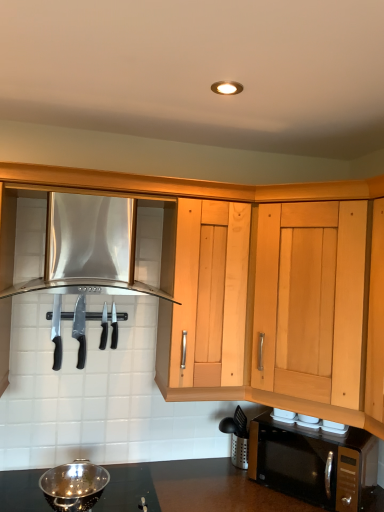
Image resolution: width=384 pixels, height=512 pixels. Find the location of `polished stainless steel bowl at lower left`. polished stainless steel bowl at lower left is located at coordinates (74, 486).

The image size is (384, 512). What do you see at coordinates (80, 329) in the screenshot?
I see `polished silver knife at center, the first knife positioned from the right` at bounding box center [80, 329].

The image size is (384, 512). What are the coordinates of `polished silver knife at center, the first knife positioned from the right` in the screenshot? It's located at (80, 329).

Locate an element on the screen. Image resolution: width=384 pixels, height=512 pixels. stainless steel range hood at upper left, marked as the first cabinetry in a left-to-right arrangement is located at coordinates (89, 248).

Image resolution: width=384 pixels, height=512 pixels. What do you see at coordinates (311, 300) in the screenshot?
I see `light wood cabinet at upper right, the first cabinetry from the right` at bounding box center [311, 300].

This screenshot has height=512, width=384. I want to click on polished stainless steel knife at center, the 2th silverware positioned from the left, so click(114, 327).

At what (x,y) coordinates should I click in order to perform the action: click on polished stainless steel bowl at lower left. Please return your answer as a coordinate pair (x, y). This screenshot has height=512, width=384. Looking at the image, I should click on (74, 486).

Is black plastic knife at left, which appears as the first knife when viewed from the left, surrounding black matte microwave at lower right?

No.

Which object is thinner, black plastic knife at left, which appears as the first knife when viewed from the left, or black matte microwave at lower right?

black plastic knife at left, which appears as the first knife when viewed from the left.

From the image's perspective, is black plastic knife at left, which appears as the first knife when viewed from the left, under black matte microwave at lower right?

No.

Can you tell me how much black plastic knife at left, which appears as the second knife when viewed from the right, and black matte microwave at lower right differ in facing direction?

black plastic knife at left, which appears as the second knife when viewed from the right, and black matte microwave at lower right are facing 47.1 degrees away from each other.

I want to click on appliance beneath the light wood cabinet at upper right, which ranks as the 2th cabinetry in left-to-right order (from a real-world perspective), so click(x=74, y=486).

Does light wood cabinet at upper right, the first cabinetry from the right, have a greater height compared to polished stainless steel bowl at lower left?

Correct, light wood cabinet at upper right, the first cabinetry from the right, is much taller as polished stainless steel bowl at lower left.

Is light wood cabinet at upper right, the first cabinetry from the right, next to polished stainless steel bowl at lower left and touching it?

No, light wood cabinet at upper right, the first cabinetry from the right, is not beside polished stainless steel bowl at lower left.

Considering the sizes of objects polished silver knife at center, the second knife viewed from the left, and stainless steel range hood at upper left, marked as the first cabinetry in a left-to-right arrangement, in the image provided, who is thinner, polished silver knife at center, the second knife viewed from the left, or stainless steel range hood at upper left, marked as the first cabinetry in a left-to-right arrangement,?

polished silver knife at center, the second knife viewed from the left.

Is point (78, 361) closer to camera compared to point (51, 195)?

No, it is behind (51, 195).

Which knife is the 2nd one when counting from the back of the stainless steel range hood at upper left, the 2th cabinetry from the right? Please provide its 2D coordinates.

[(80, 329)]

From a real-world perspective, between polished silver knife at center, the first knife positioned from the right, and stainless steel range hood at upper left, marked as the first cabinetry in a left-to-right arrangement, who is vertically higher?

stainless steel range hood at upper left, marked as the first cabinetry in a left-to-right arrangement, is physically above.

Based on the photo, is stainless steel range hood at upper left, the 2th cabinetry from the right, closer to the viewer compared to black plastic knife at center, the first silverware viewed from the left?

Yes, it is.

Measure the distance between stainless steel range hood at upper left, marked as the first cabinetry in a left-to-right arrangement, and black plastic knife at center, arranged as the second silverware when viewed from the right.

stainless steel range hood at upper left, marked as the first cabinetry in a left-to-right arrangement, is 14.92 inches away from black plastic knife at center, arranged as the second silverware when viewed from the right.

Based on the photo, how many degrees apart are the facing directions of stainless steel range hood at upper left, the 2th cabinetry from the right, and black plastic knife at center, the first silverware viewed from the left?

The angular difference between stainless steel range hood at upper left, the 2th cabinetry from the right, and black plastic knife at center, the first silverware viewed from the left, is 0.163 degrees.

Considering the sizes of objects stainless steel range hood at upper left, the 2th cabinetry from the right, and black plastic knife at center, the first silverware viewed from the left, in the image provided, who is wider, stainless steel range hood at upper left, the 2th cabinetry from the right, or black plastic knife at center, the first silverware viewed from the left,?

With larger width is stainless steel range hood at upper left, the 2th cabinetry from the right.

Who is smaller, stainless steel range hood at upper left, the 2th cabinetry from the right, or polished stainless steel knife at center, the 2th silverware positioned from the left?

With smaller size is polished stainless steel knife at center, the 2th silverware positioned from the left.

Consider the image. Which is correct: stainless steel range hood at upper left, the 2th cabinetry from the right, is inside polished stainless steel knife at center, the 2th silverware positioned from the left, or outside of it?

stainless steel range hood at upper left, the 2th cabinetry from the right, exists outside the volume of polished stainless steel knife at center, the 2th silverware positioned from the left.

Identify the location of the 2nd silverware behind the stainless steel range hood at upper left, marked as the first cabinetry in a left-to-right arrangement. This screenshot has height=512, width=384. (114, 327).

Considering the sizes of light wood cabinet at upper right, the first cabinetry from the right, and stainless steel range hood at upper left, the 2th cabinetry from the right, in the image, is light wood cabinet at upper right, the first cabinetry from the right, wider or thinner than stainless steel range hood at upper left, the 2th cabinetry from the right,?

Clearly, light wood cabinet at upper right, the first cabinetry from the right, has less width compared to stainless steel range hood at upper left, the 2th cabinetry from the right.

Is light wood cabinet at upper right, which ranks as the 2th cabinetry in left-to-right order, next to stainless steel range hood at upper left, marked as the first cabinetry in a left-to-right arrangement?

No, light wood cabinet at upper right, which ranks as the 2th cabinetry in left-to-right order, is not next to stainless steel range hood at upper left, marked as the first cabinetry in a left-to-right arrangement.

Which is more to the left, light wood cabinet at upper right, which ranks as the 2th cabinetry in left-to-right order, or stainless steel range hood at upper left, the 2th cabinetry from the right?

stainless steel range hood at upper left, the 2th cabinetry from the right, is more to the left.

Which of these two, light wood cabinet at upper right, which ranks as the 2th cabinetry in left-to-right order, or stainless steel range hood at upper left, marked as the first cabinetry in a left-to-right arrangement, is bigger?

Bigger between the two is light wood cabinet at upper right, which ranks as the 2th cabinetry in left-to-right order.

Can you confirm if black plastic knife at center, the first silverware viewed from the left, is wider than polished stainless steel knife at center, the 2th silverware positioned from the left?

Incorrect, the width of black plastic knife at center, the first silverware viewed from the left, does not surpass that of polished stainless steel knife at center, the 2th silverware positioned from the left.

Measure the distance from black plastic knife at center, arranged as the second silverware when viewed from the right, to polished stainless steel knife at center, the 2th silverware positioned from the left.

A distance of 1.46 inches exists between black plastic knife at center, arranged as the second silverware when viewed from the right, and polished stainless steel knife at center, the 2th silverware positioned from the left.

In the scene shown: Is black plastic knife at center, arranged as the second silverware when viewed from the right, taller or shorter than polished stainless steel knife at center, the 2th silverware positioned from the left?

Clearly, black plastic knife at center, arranged as the second silverware when viewed from the right, is shorter compared to polished stainless steel knife at center, the 2th silverware positioned from the left.

Locate an element on the screen. The image size is (384, 512). silverware that appears behind the black plastic knife at center, arranged as the second silverware when viewed from the right is located at coordinates (114, 327).

Find the location of `microwave oven in front of the black plastic knife at left, which appears as the second knife when viewed from the right`. microwave oven in front of the black plastic knife at left, which appears as the second knife when viewed from the right is located at coordinates (312, 462).

Where is `appliance that is under the light wood cabinet at upper right, which ranks as the 2th cabinetry in left-to-right order (from a real-world perspective)`? The height and width of the screenshot is (512, 384). appliance that is under the light wood cabinet at upper right, which ranks as the 2th cabinetry in left-to-right order (from a real-world perspective) is located at coordinates (74, 486).

From the picture: From the image, which object appears to be nearer to polished silver knife at center, the second knife viewed from the left, black matte microwave at lower right or polished stainless steel knife at center, which is counted as the 1th silverware, starting from the right?

Based on the image, polished stainless steel knife at center, which is counted as the 1th silverware, starting from the right, appears to be nearer to polished silver knife at center, the second knife viewed from the left.

When comparing their distances from black matte microwave at lower right, does stainless steel range hood at upper left, the 2th cabinetry from the right, or polished silver knife at center, the first knife positioned from the right, seem further?

Based on the image, polished silver knife at center, the first knife positioned from the right, appears to be further to black matte microwave at lower right.

Considering their positions, is polished stainless steel knife at center, which is counted as the 1th silverware, starting from the right, positioned further to stainless steel range hood at upper left, marked as the first cabinetry in a left-to-right arrangement, than polished stainless steel bowl at lower left?

polished stainless steel bowl at lower left is positioned further to the anchor stainless steel range hood at upper left, marked as the first cabinetry in a left-to-right arrangement.

Which object lies further to the anchor point polished stainless steel knife at center, the 2th silverware positioned from the left, black plastic knife at center, arranged as the second silverware when viewed from the right, or black plastic knife at left, which appears as the first knife when viewed from the left?

Among the two, black plastic knife at left, which appears as the first knife when viewed from the left, is located further to polished stainless steel knife at center, the 2th silverware positioned from the left.

Based on their spatial positions, is black plastic knife at center, the first silverware viewed from the left, or polished silver knife at center, the first knife positioned from the right, further from stainless steel range hood at upper left, the 2th cabinetry from the right?

black plastic knife at center, the first silverware viewed from the left, is further to stainless steel range hood at upper left, the 2th cabinetry from the right.

Estimate the real-world distances between objects in this image. Which object is further from polished stainless steel knife at center, which is counted as the 1th silverware, starting from the right, polished silver knife at center, the first knife positioned from the right, or black matte microwave at lower right?

The object further to polished stainless steel knife at center, which is counted as the 1th silverware, starting from the right, is black matte microwave at lower right.

Considering their positions, is black plastic knife at center, the first silverware viewed from the left, positioned closer to black matte microwave at lower right than polished stainless steel bowl at lower left?

Among the two, polished stainless steel bowl at lower left is located nearer to black matte microwave at lower right.

Which object lies nearer to the anchor point black matte microwave at lower right, black plastic knife at left, which appears as the first knife when viewed from the left, or polished stainless steel bowl at lower left?

polished stainless steel bowl at lower left lies closer to black matte microwave at lower right than the other object.

This screenshot has height=512, width=384. In order to click on appliance between polished silver knife at center, the second knife viewed from the left, and black matte microwave at lower right, in the horizontal direction in this screenshot , I will do `click(74, 486)`.

At what (x,y) coordinates should I click in order to perform the action: click on microwave oven between black plastic knife at center, arranged as the second silverware when viewed from the right, and light wood cabinet at upper right, the first cabinetry from the right, from left to right. Please return your answer as a coordinate pair (x, y). This screenshot has width=384, height=512. Looking at the image, I should click on (312, 462).

Image resolution: width=384 pixels, height=512 pixels. Identify the location of silverware between black plastic knife at center, the first silverware viewed from the left, and light wood cabinet at upper right, the first cabinetry from the right, from left to right. (114, 327).

The image size is (384, 512). In order to click on silverware located between polished silver knife at center, the first knife positioned from the right, and polished stainless steel knife at center, the 2th silverware positioned from the left, in the left-right direction in this screenshot , I will do `click(104, 328)`.